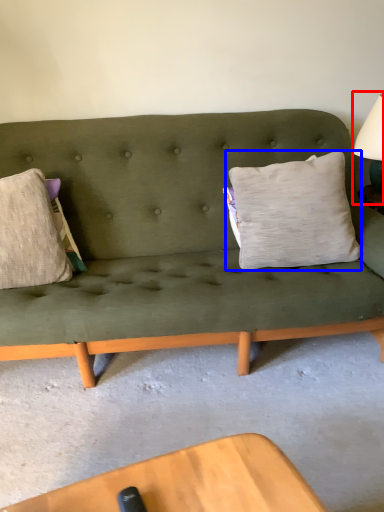
Question: Which object is further to the camera taking this photo, table lamp (highlighted by a red box) or pillow (highlighted by a blue box)?

Choices:
 (A) table lamp
 (B) pillow

Answer: (A)